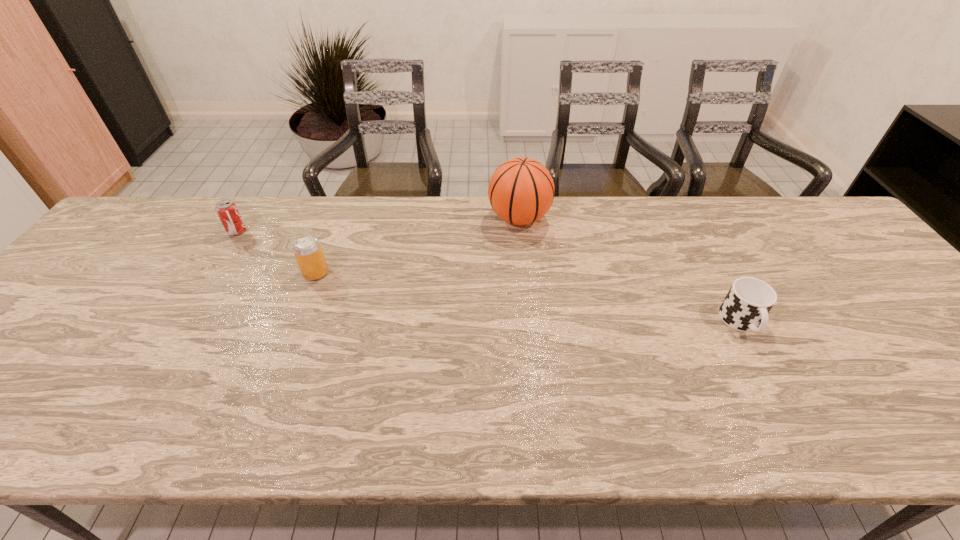
Identify the location of vacant point that satisfies the following two spatial constraints: 1. on the front side of the right soda can; 2. on the right side of the left soda can. The width and height of the screenshot is (960, 540). (212, 273).